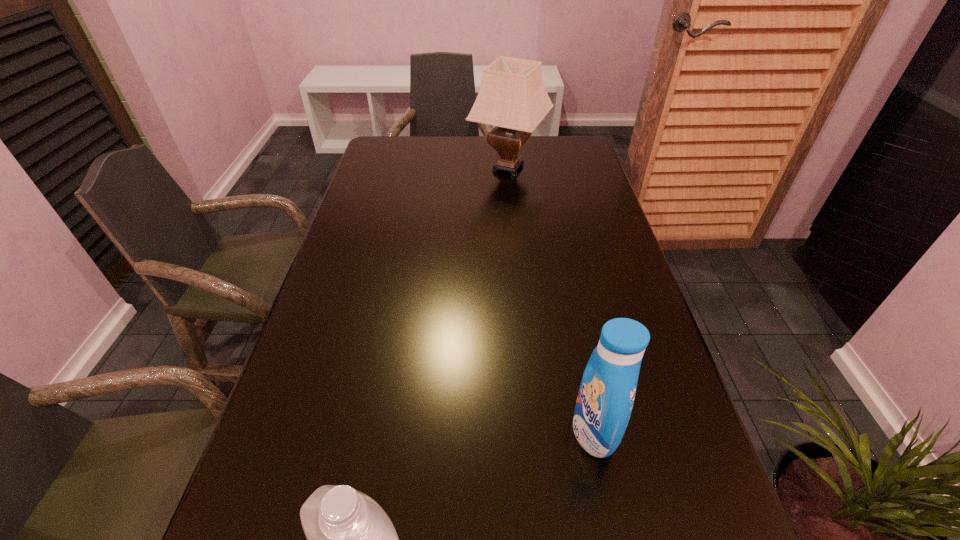
The width and height of the screenshot is (960, 540). Find the location of `object that ranks as the second closest to the leftmost object`. object that ranks as the second closest to the leftmost object is located at coordinates (512, 97).